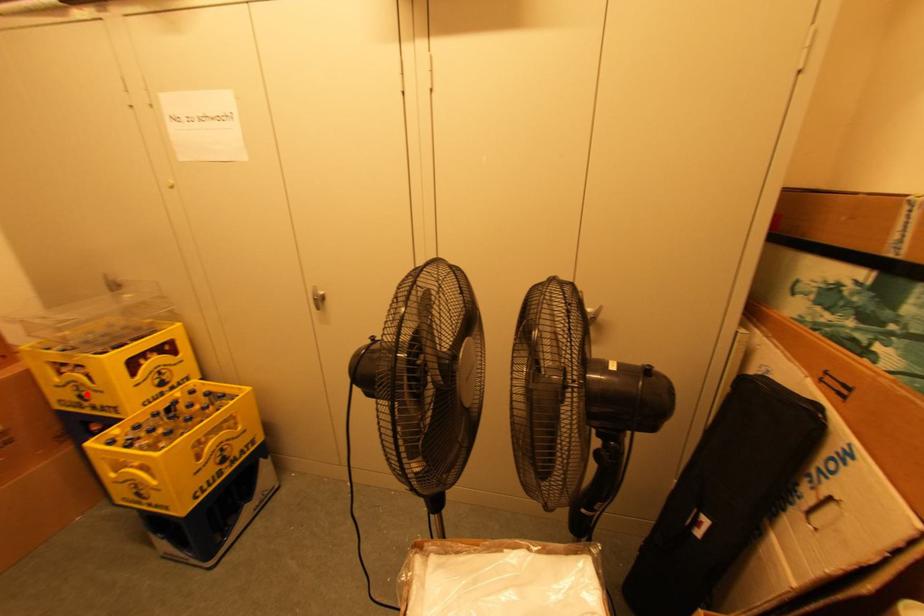
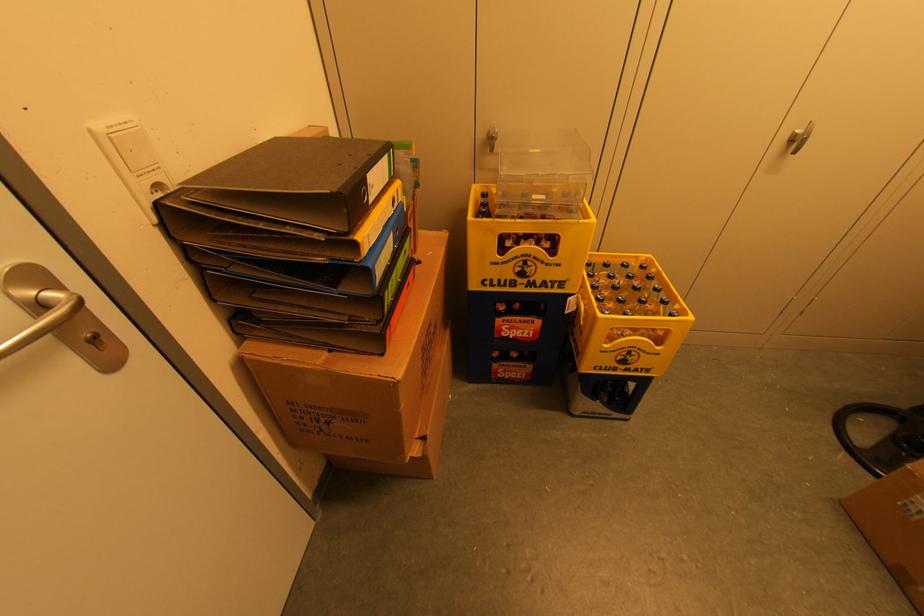
Question: I am providing you with two images of the same scene from different viewpoints. A red point is shown in image1. For the corresponding object point in image2, is it positioned nearer or farther from the camera?

Choices:
 (A) Nearer
 (B) Farther

Answer: (B)